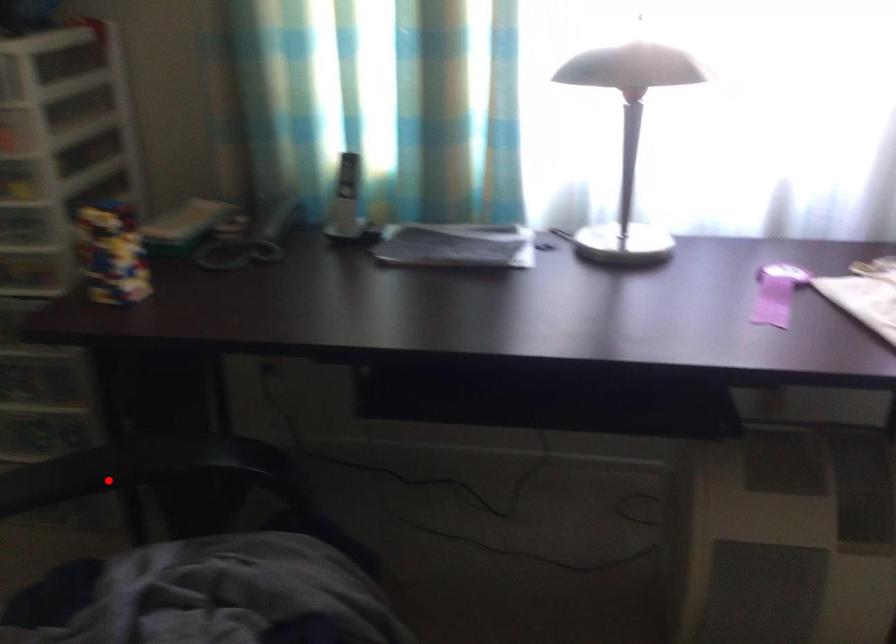
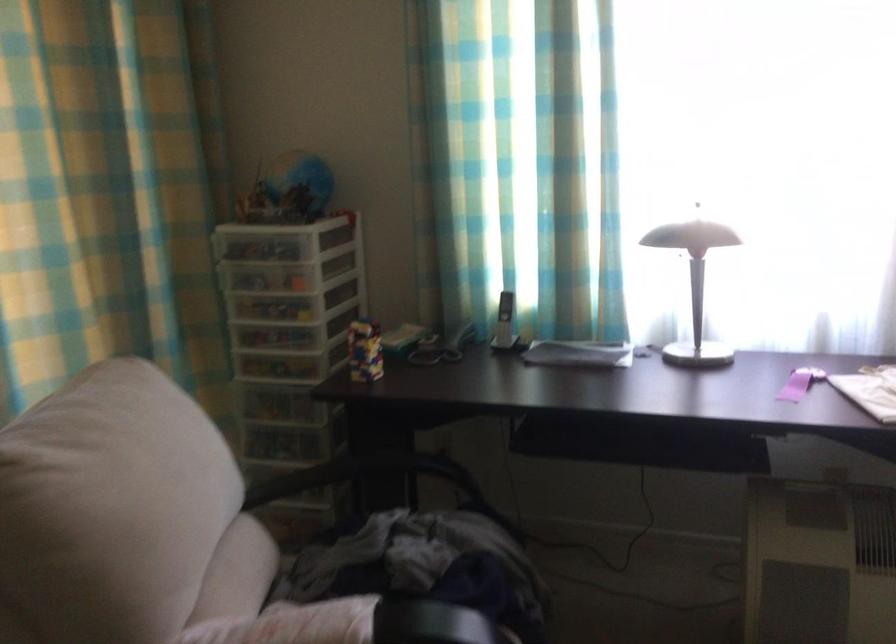
Where in the second image is the point corresponding to the highlighted location from the first image?

(362, 474)